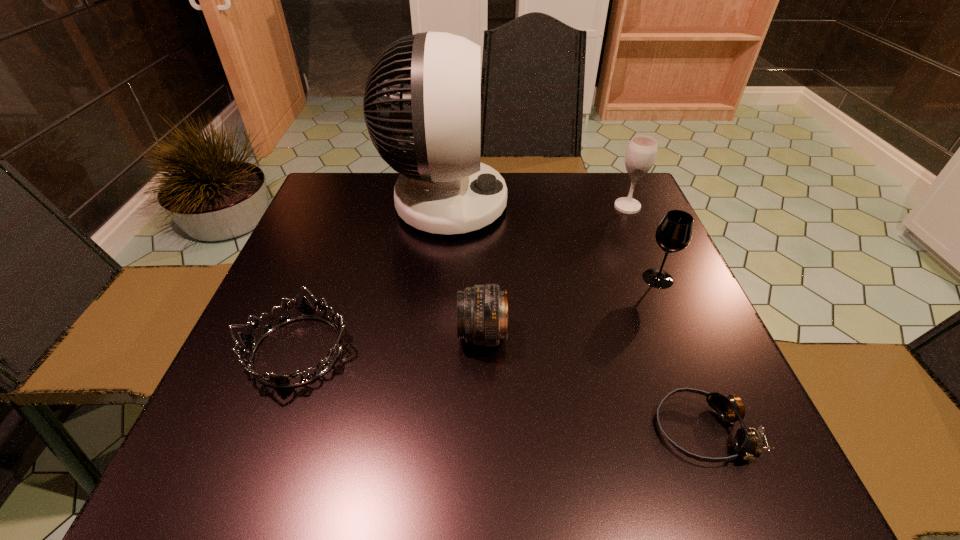
The image size is (960, 540). I want to click on vacant area between the shortest object and the fan, so click(574, 317).

Locate an element on the screen. free spot between the tallest object and the farther wineglass is located at coordinates (537, 205).

The image size is (960, 540). Identify the location of vacant area that lies between the farther wineglass and the nearer wineglass. (642, 242).

Find the location of a particular element. The image size is (960, 540). free space between the farther wineglass and the fifth tallest object is located at coordinates (463, 279).

Find the location of a particular element. The height and width of the screenshot is (540, 960). vacant area that lies between the farther wineglass and the fifth tallest object is located at coordinates (463, 279).

Where is `empty space between the shortest object and the telephoto lens`? The width and height of the screenshot is (960, 540). empty space between the shortest object and the telephoto lens is located at coordinates (592, 382).

Where is `free point between the farther wineglass and the shortest object`? free point between the farther wineglass and the shortest object is located at coordinates (664, 319).

What are the coordinates of `vacant region between the goggles and the telephoto lens` in the screenshot? It's located at (592, 382).

This screenshot has width=960, height=540. Identify the location of blank region between the telephoto lens and the farther wineglass. (555, 271).

This screenshot has height=540, width=960. What are the coordinates of `object that is the fifth nearest to the third farthest object` in the screenshot? It's located at (306, 310).